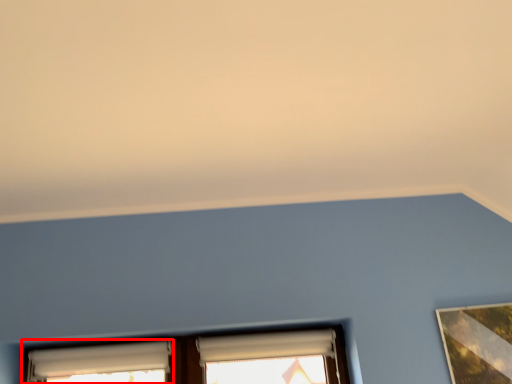
Question: Where is window (annotated by the red box) located in relation to window in the image?

Choices:
 (A) left
 (B) right

Answer: (A)